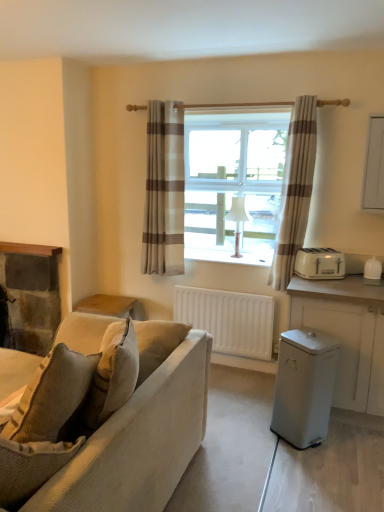
I want to click on free location to the right of white plastic trash can at lower right, arranged as the first appliance when ordered from the bottom, so click(347, 439).